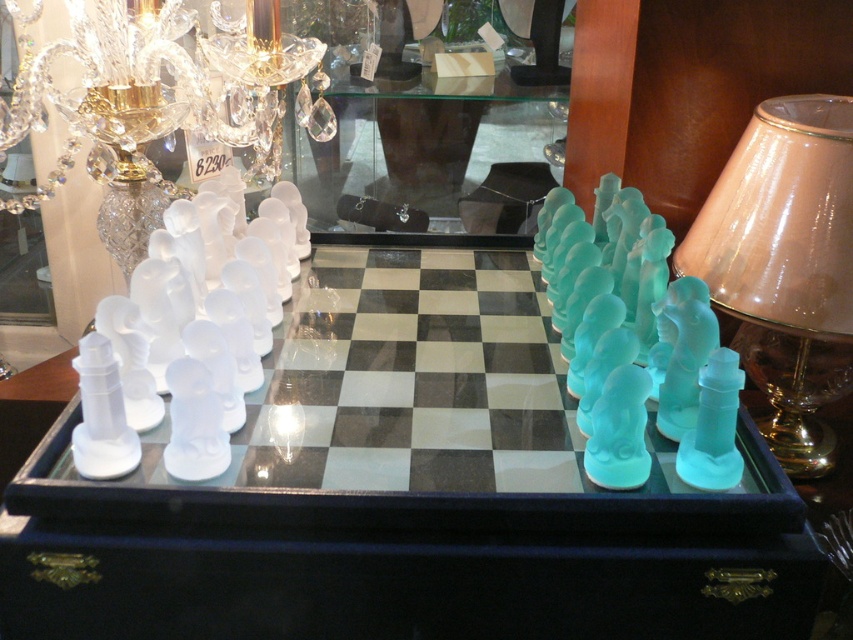
Who is more forward, (64,440) or (827,355)?

Point (64,440) is more forward.

How much distance is there between translucent glass chessboard at center and translucent glass lampshade at right?

translucent glass chessboard at center and translucent glass lampshade at right are 15.29 inches apart.

Find the location of a particular element. translucent glass chessboard at center is located at coordinates (405, 493).

Can you confirm if clear crystal chandelier at upper left is positioned to the left of transparent glass table at center?

Indeed, clear crystal chandelier at upper left is positioned on the left side of transparent glass table at center.

Find the location of a particular element. The image size is (853, 640). clear crystal chandelier at upper left is located at coordinates (149, 99).

Identify the location of clear crystal chandelier at upper left. (149, 99).

Where is `clear crystal chandelier at upper left`? clear crystal chandelier at upper left is located at coordinates (149, 99).

Which is behind, point (811, 218) or point (473, 120)?

Positioned behind is point (473, 120).

Measure the distance between point (x=809, y=353) and camera.

A distance of 3.56 feet exists between point (x=809, y=353) and camera.

Locate an element on the screen. This screenshot has height=640, width=853. translucent glass lampshade at right is located at coordinates (785, 266).